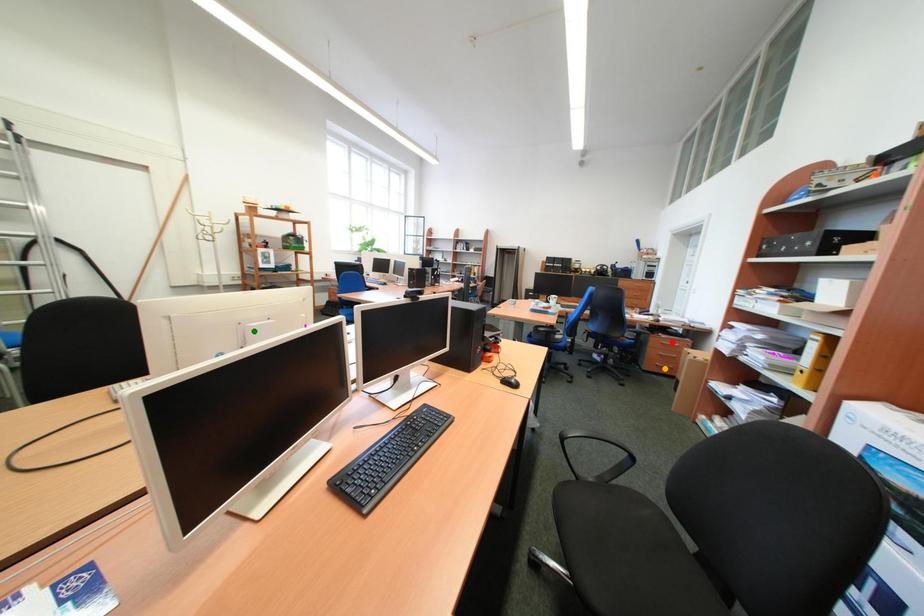
Order these from farthest to nearest:
green point, red point, orange point

orange point → red point → green point